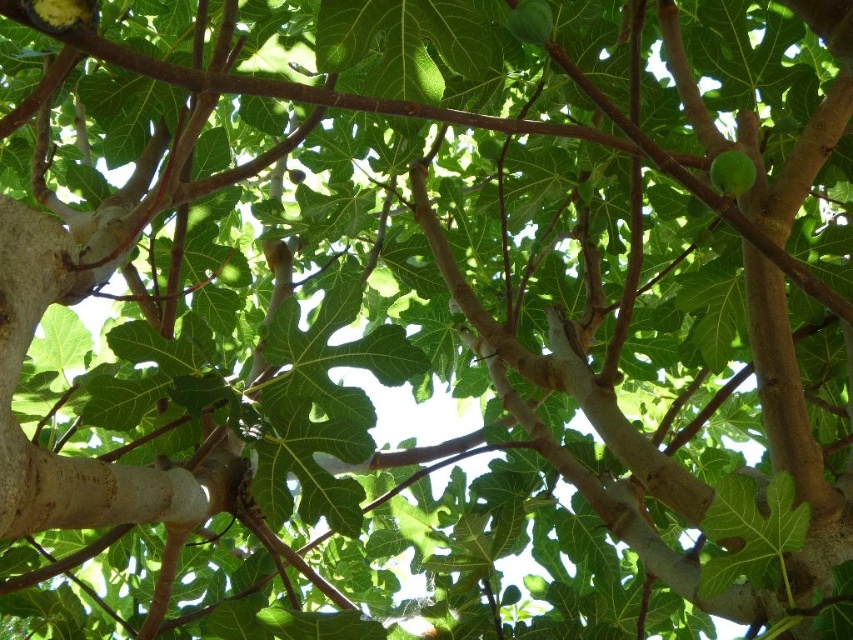
Question: Among these points, which one is nearest to the camera?

Choices:
 (A) (86, 10)
 (B) (751, 179)
 (C) (549, 17)

Answer: (A)

Question: Does yellowish-green smooth fig at upper left have a smaller size compared to green matte fig at upper right?

Choices:
 (A) yes
 (B) no

Answer: (A)

Question: Can you confirm if yellowish-green smooth fig at upper left is positioned below green matte fig at upper center?

Choices:
 (A) yes
 (B) no

Answer: (A)

Question: Which of the following is the farthest from the observer?

Choices:
 (A) (x=746, y=163)
 (B) (x=36, y=16)

Answer: (A)

Question: In this image, where is yellowish-green smooth fig at upper left located relative to green matte fig at upper center?

Choices:
 (A) below
 (B) above

Answer: (A)

Question: Estimate the real-world distances between objects in this image. Which object is closer to the green matte fig at upper right?

Choices:
 (A) yellowish-green smooth fig at upper left
 (B) green matte fig at upper center

Answer: (B)